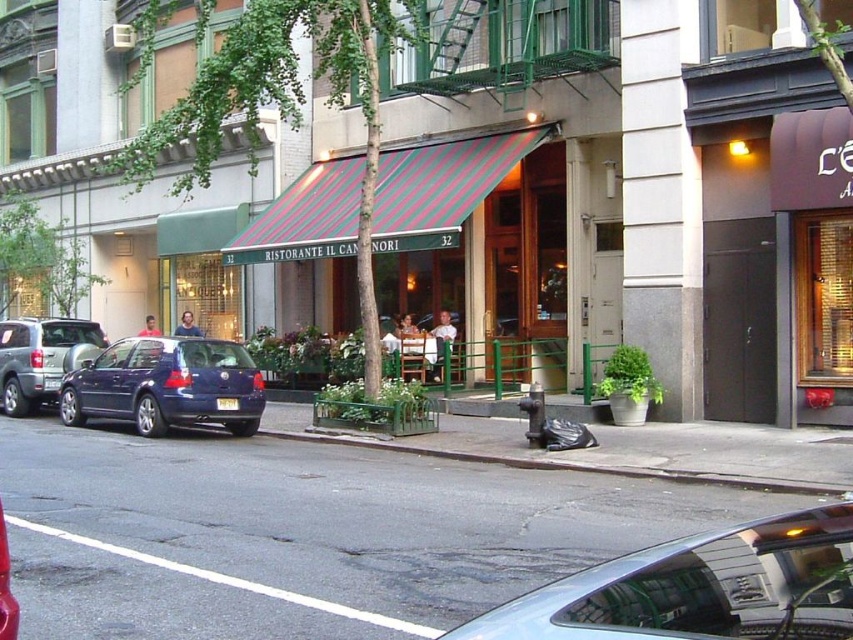
You are a delivery person who needs to park your motorcycle between the silver metallic car at center and the metallic blue hatchback at left. Is there enough space between them for your motorcycle, which is 1.5 meters wide?

The silver metallic car at center is to the right of the metallic blue hatchback at left, but the distance between them isn not specified. Without knowing the exact space between them, it is impossible to determine if the motorcycle can fit.

You are a delivery driver who needs to park your truck, which is 2 meters tall, in the parking lot behind the Ristorante Il Canori. The parking spot is between the silver metallic car at center and the metallic silver suv at left. Can your truck fit in the parking spot without hitting the roof?

The silver metallic car at center is shorter than the metallic silver suv at left, but the description only mentions their height comparison. Since the truck is 2 meters tall, we need to know the actual height of the taller vehicle. Without specific height measurements, it is impossible to determine if the truck can fit.